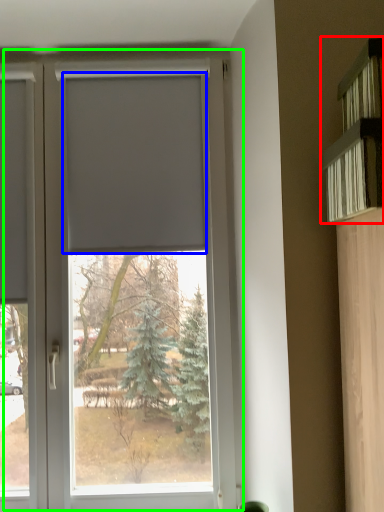
Question: Estimate the real-world distances between objects in this image. Which object is closer to shelf (highlighted by a red box), blind (highlighted by a blue box) or window (highlighted by a green box)?

Choices:
 (A) blind
 (B) window

Answer: (A)